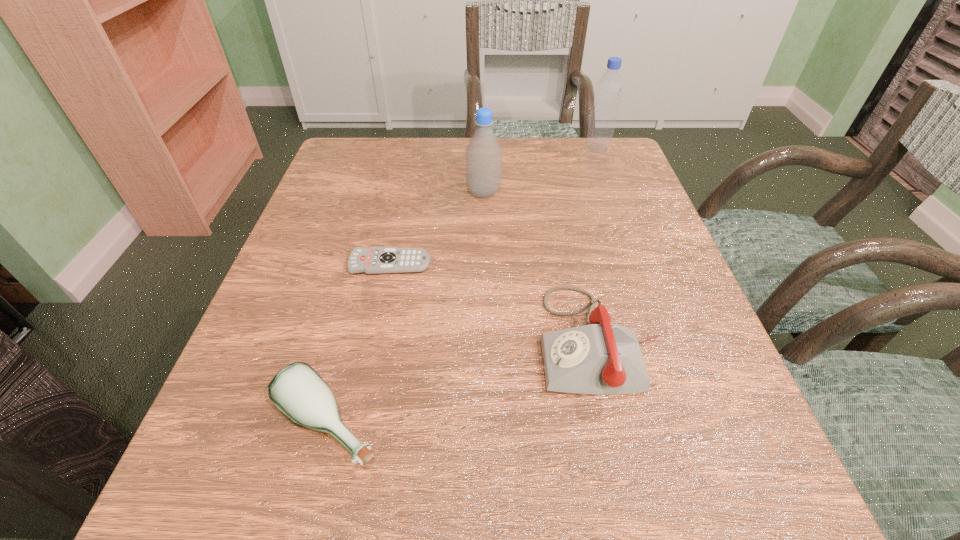
This screenshot has width=960, height=540. In order to click on the rightmost bottle in this screenshot , I will do `click(609, 88)`.

I want to click on the farthest object, so click(609, 88).

The image size is (960, 540). What are the coordinates of `the second bottle from left to right` in the screenshot? It's located at (483, 155).

You are a GUI agent. You are given a task and a screenshot of the screen. Output one action in this format:
    pyautogui.click(x=<x>, y=<y>)
    Task: Click on the second farthest bottle
    Image resolution: width=960 pixels, height=540 pixels.
    Given the screenshot: What is the action you would take?
    pyautogui.click(x=483, y=155)

Identify the location of telephone. (598, 358).

This screenshot has height=540, width=960. What are the coordinates of `the shortest bottle` in the screenshot? It's located at (297, 390).

You are a GUI agent. You are given a task and a screenshot of the screen. Output one action in this format:
    pyautogui.click(x=<x>, y=<y>)
    Task: Click on the nearest bottle
    The image size is (960, 540).
    Given the screenshot: What is the action you would take?
    pyautogui.click(x=297, y=390)

Where is `remote control`? This screenshot has height=540, width=960. remote control is located at coordinates (375, 260).

I want to click on the shortest object, so click(375, 260).

Find the location of a particular element. The width and height of the screenshot is (960, 540). blank space located 0.370m on the front of the farthest object is located at coordinates (636, 250).